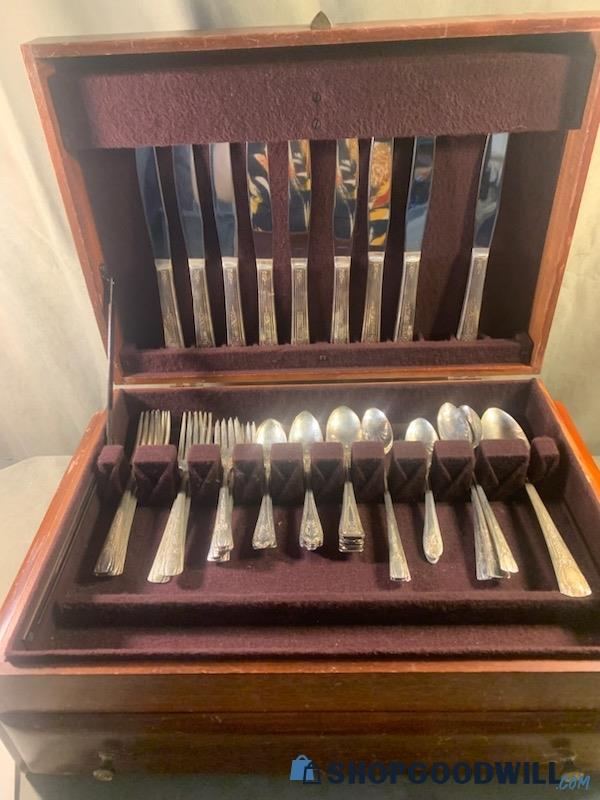
This screenshot has width=600, height=800. Find the location of `knives`. knives is located at coordinates (161, 222), (187, 224), (227, 222), (262, 222), (307, 220), (339, 216), (376, 216), (412, 218), (478, 220).